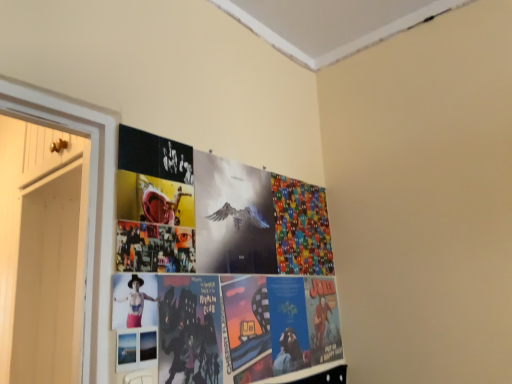
Question: Is the depth of white wood door at left less than that of multicolored fabric at upper right, which is the second flyer in front-to-back order?

Choices:
 (A) no
 (B) yes

Answer: (B)

Question: From a real-world perspective, does white wood door at left stand above multicolored fabric at upper right, which appears as the 1th flyer when viewed from the back?

Choices:
 (A) yes
 (B) no

Answer: (B)

Question: Is white wood door at left positioned beyond the bounds of multicolored fabric at upper right, which appears as the first flyer when viewed from the right?

Choices:
 (A) no
 (B) yes

Answer: (B)

Question: Considering the relative sizes of white wood door at left and multicolored fabric at upper right, which appears as the first flyer when viewed from the right, in the image provided, is white wood door at left shorter than multicolored fabric at upper right, which appears as the first flyer when viewed from the right,?

Choices:
 (A) yes
 (B) no

Answer: (B)

Question: Is white wood door at left turned away from multicolored fabric at upper right, arranged as the 2th flyer when viewed from the left?

Choices:
 (A) yes
 (B) no

Answer: (B)

Question: Considering the positions of white wood door at left and matte black person at center in the image, is white wood door at left wider or thinner than matte black person at center?

Choices:
 (A) thin
 (B) wide

Answer: (B)

Question: Considering the relative positions of white wood door at left and matte black person at center in the image provided, is white wood door at left to the left or to the right of matte black person at center?

Choices:
 (A) left
 (B) right

Answer: (A)

Question: Relative to matte black person at center, is white wood door at left in front or behind?

Choices:
 (A) front
 (B) behind

Answer: (B)

Question: Based on their sizes in the image, would you say white wood door at left is bigger or smaller than matte black person at center?

Choices:
 (A) small
 (B) big

Answer: (B)

Question: Considering the positions of metallic silver poster at center, the second flyer when ordered from right to left, and multicolored fabric at upper right, which is the second flyer in front-to-back order, in the image, is metallic silver poster at center, the second flyer when ordered from right to left, taller or shorter than multicolored fabric at upper right, which is the second flyer in front-to-back order,?

Choices:
 (A) tall
 (B) short

Answer: (B)

Question: From the image's perspective, relative to multicolored fabric at upper right, arranged as the 2th flyer when viewed from the left, is metallic silver poster at center, placed as the 1th flyer when sorted from front to back, above or below?

Choices:
 (A) below
 (B) above

Answer: (B)

Question: In the image, is metallic silver poster at center, marked as the first flyer in a left-to-right arrangement, on the left side or the right side of multicolored fabric at upper right, which appears as the first flyer when viewed from the right?

Choices:
 (A) right
 (B) left

Answer: (B)

Question: Is point (253, 269) positioned closer to the camera than point (289, 256)?

Choices:
 (A) farther
 (B) closer

Answer: (B)

Question: Is metallic silver poster at center, placed as the 1th flyer when sorted from front to back, inside the boundaries of white wood door at left, or outside?

Choices:
 (A) outside
 (B) inside

Answer: (A)

Question: Is metallic silver poster at center, the second flyer when ordered from right to left, wider or thinner than white wood door at left?

Choices:
 (A) thin
 (B) wide

Answer: (A)